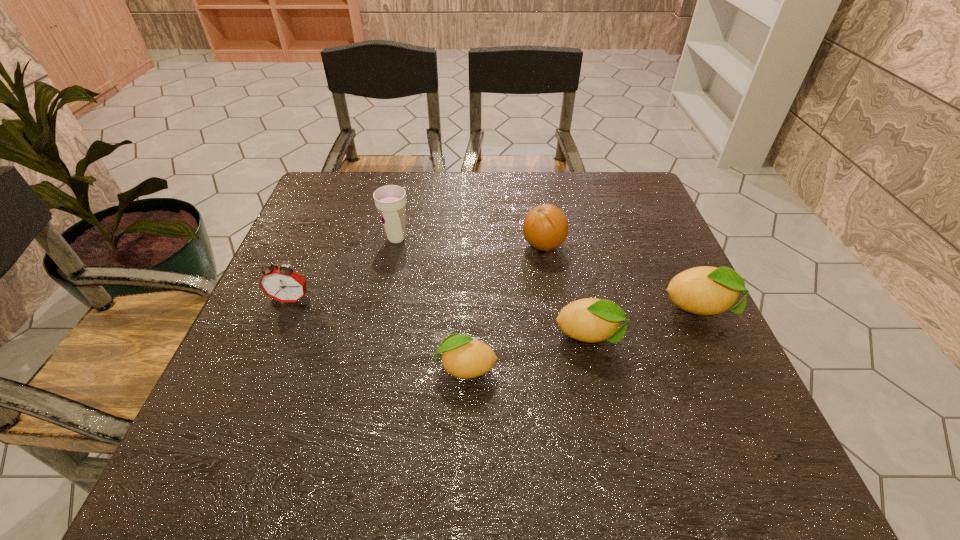
The image size is (960, 540). I want to click on vacant space located with leaves positioned above the second lemon from right to left, so click(x=675, y=337).

Locate an element on the screen. free point located 0.170m on the back of the fifth object from right to left is located at coordinates (406, 193).

Where is `vacant position located 0.070m on the left of the orange`? The image size is (960, 540). vacant position located 0.070m on the left of the orange is located at coordinates (493, 245).

This screenshot has height=540, width=960. Find the location of `free spot located 0.100m on the clock face of the leftmost object`. free spot located 0.100m on the clock face of the leftmost object is located at coordinates (273, 343).

Locate an element on the screen. The height and width of the screenshot is (540, 960). object positioned at the near edge is located at coordinates (463, 357).

I want to click on object located in the left edge section of the desktop, so click(x=283, y=284).

You are a GUI agent. You are given a task and a screenshot of the screen. Output one action in this format:
    pyautogui.click(x=<x>, y=<y>)
    Task: Click on the object located at the right edge
    This screenshot has height=540, width=960.
    Given the screenshot: What is the action you would take?
    pyautogui.click(x=705, y=290)

Image resolution: width=960 pixels, height=540 pixels. In the image, there is a desktop. In order to click on vacant space at the far edge in this screenshot , I will do `click(540, 205)`.

Locate an element on the screen. free space at the near edge of the desktop is located at coordinates (436, 381).

The image size is (960, 540). Identify the location of free space at the left edge of the desktop. (348, 238).